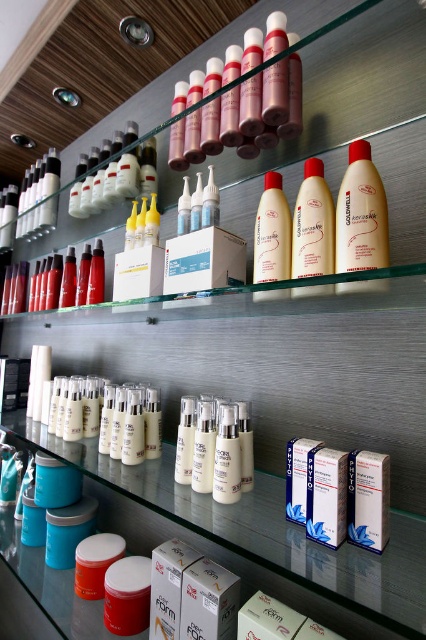
From the picture: Can you confirm if white matte tube at center is bigger than blue cardboard box at center?

No, white matte tube at center is not bigger than blue cardboard box at center.

Does white matte tube at center appear under blue cardboard box at center?

Indeed, white matte tube at center is positioned under blue cardboard box at center.

What do you see at coordinates (368, 499) in the screenshot? The image size is (426, 640). I see `white matte tube at center` at bounding box center [368, 499].

You are a GUI agent. You are given a task and a screenshot of the screen. Output one action in this format:
    pyautogui.click(x=<x>, y=<y>)
    Task: Click on the white matte tube at center
    
    Given the screenshot: What is the action you would take?
    pyautogui.click(x=368, y=499)

Does point (305, 209) come in front of point (282, 262)?

Yes, it is in front of point (282, 262).

Does point (302, 291) lie behind point (287, 221)?

No, it is in front of (287, 221).

Identify the location of matte beige lotion at center. Image resolution: width=426 pixels, height=640 pixels. (313, 225).

What do you see at coordinates (271, 232) in the screenshot? Image resolution: width=426 pixels, height=640 pixels. I see `matte cream bottle at center` at bounding box center [271, 232].

Which is more to the right, matte cream bottle at center or blue cardboard box at center?

blue cardboard box at center

Is point (253, 269) closer to viewer compared to point (298, 444)?

No, it is behind (298, 444).

The height and width of the screenshot is (640, 426). In order to click on matte cream bottle at center in this screenshot , I will do `click(271, 232)`.